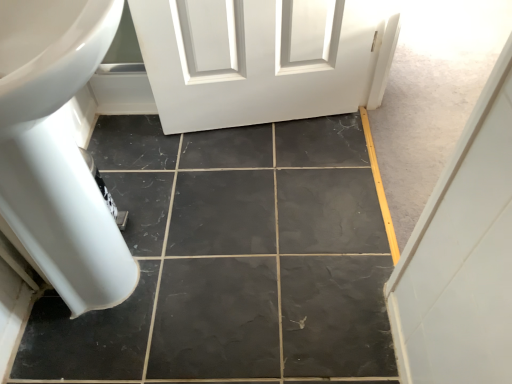
Find the location of `free point to the right of white glossy bath at left`. free point to the right of white glossy bath at left is located at coordinates (271, 259).